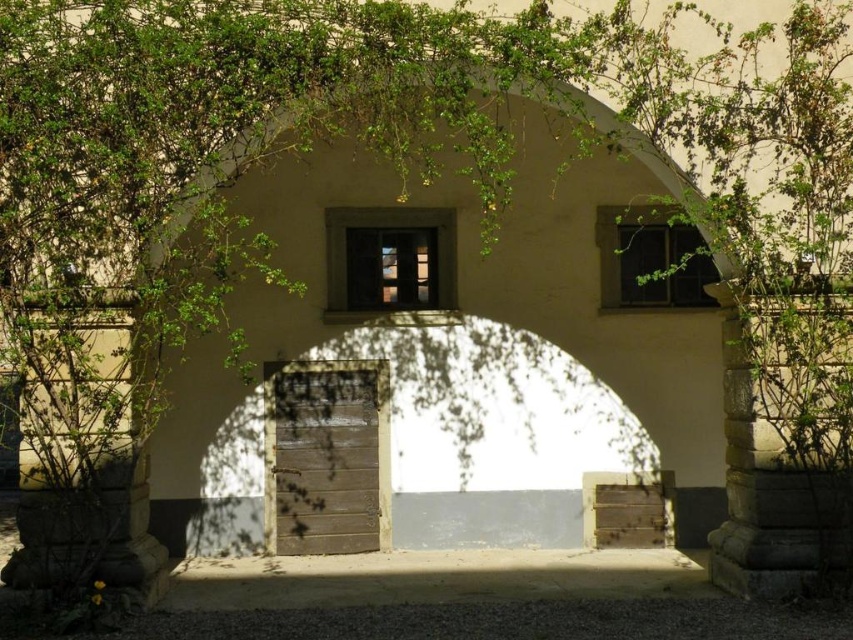
You are an architect analyzing the symmetry of the arched entranceway. You notice two matte glass windows. Which one has a greater width between the two? The options are the matte glass window at center and the matte glass window at upper right.

The matte glass window at upper right has a greater width because the matte glass window at center is thinner than it.